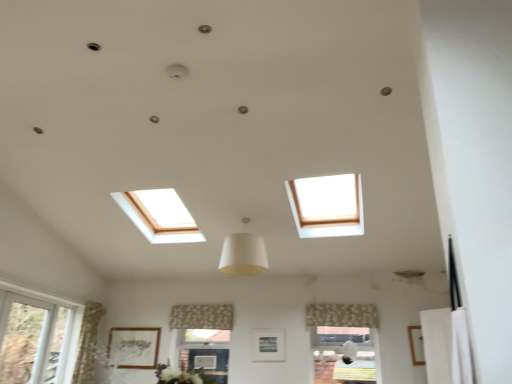
Question: Is matte silver picture frame at center, the 2th picture frame when ordered from right to left, with white fabric lampshade at center?

Choices:
 (A) no
 (B) yes

Answer: (A)

Question: Can you confirm if matte silver picture frame at center, arranged as the second picture frame when viewed from the left, is bigger than white fabric lampshade at center?

Choices:
 (A) no
 (B) yes

Answer: (A)

Question: From the image's perspective, does matte silver picture frame at center, arranged as the second picture frame when viewed from the left, appear lower than white fabric lampshade at center?

Choices:
 (A) yes
 (B) no

Answer: (A)

Question: Are matte silver picture frame at center, the 2th picture frame when ordered from right to left, and white fabric lampshade at center located far from each other?

Choices:
 (A) no
 (B) yes

Answer: (B)

Question: Could you tell me if matte silver picture frame at center, which is the 2th picture frame in front-to-back order, is facing white fabric lampshade at center?

Choices:
 (A) yes
 (B) no

Answer: (B)

Question: Considering the positions of white fabric lampshade at center and wooden picture frame at lower right, which is counted as the 3th picture frame, starting from the back, in the image, is white fabric lampshade at center taller or shorter than wooden picture frame at lower right, which is counted as the 3th picture frame, starting from the back,?

Choices:
 (A) tall
 (B) short

Answer: (A)

Question: Is point (266, 266) positioned closer to the camera than point (420, 347)?

Choices:
 (A) farther
 (B) closer

Answer: (B)

Question: From the image's perspective, relative to wooden picture frame at lower right, which is counted as the 3th picture frame, starting from the back, is white fabric lampshade at center above or below?

Choices:
 (A) above
 (B) below

Answer: (A)

Question: Considering their positions, is white fabric lampshade at center located in front of or behind wooden picture frame at lower right, marked as the 3th picture frame in a left-to-right arrangement?

Choices:
 (A) behind
 (B) front

Answer: (B)

Question: From a real-world perspective, is patterned fabric curtain at lower center, the first curtain when ordered from front to back, positioned above or below matte white picture frame at lower center, the first picture frame in the left-to-right sequence?

Choices:
 (A) above
 (B) below

Answer: (A)

Question: In terms of height, does patterned fabric curtain at lower center, arranged as the second curtain when viewed from the back, look taller or shorter compared to matte white picture frame at lower center, which appears as the third picture frame when viewed from the front?

Choices:
 (A) short
 (B) tall

Answer: (A)

Question: Is patterned fabric curtain at lower center, arranged as the second curtain when viewed from the back, bigger or smaller than matte white picture frame at lower center, which appears as the third picture frame when viewed from the front?

Choices:
 (A) big
 (B) small

Answer: (A)

Question: Is patterned fabric curtain at lower center, positioned as the 2th curtain in left-to-right order, wider or thinner than matte white picture frame at lower center, the 1th picture frame viewed from the back?

Choices:
 (A) wide
 (B) thin

Answer: (A)

Question: Based on their sizes in the image, would you say wooden picture frame at lower right, the first picture frame viewed from the front, is bigger or smaller than floral fabric curtain at center, arranged as the 2th curtain when viewed from the front?

Choices:
 (A) small
 (B) big

Answer: (A)

Question: Is wooden picture frame at lower right, marked as the 3th picture frame in a left-to-right arrangement, in front of or behind floral fabric curtain at center, which is counted as the 1th curtain, starting from the left, in the image?

Choices:
 (A) behind
 (B) front

Answer: (B)